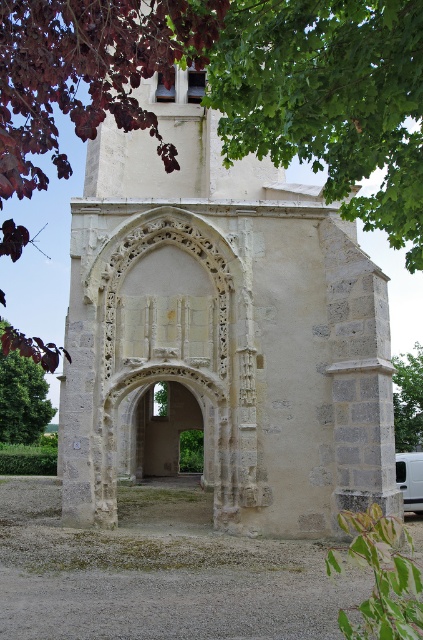
Question: Can you confirm if stone archway at center is positioned below green leafy tree at lower left?

Choices:
 (A) yes
 (B) no

Answer: (B)

Question: Estimate the real-world distances between objects in this image. Which object is farther from the green leafy tree at lower left?

Choices:
 (A) green leafy tree at right
 (B) white matte van at right
 (C) stone archway at center

Answer: (B)

Question: Estimate the real-world distances between objects in this image. Which object is closer to the stone archway at center?

Choices:
 (A) white matte van at right
 (B) green leafy tree at lower left

Answer: (A)

Question: Can you confirm if green leafy tree at lower left is wider than green leafy tree at right?

Choices:
 (A) no
 (B) yes

Answer: (B)

Question: Which of the following is the closest to the observer?

Choices:
 (A) white matte van at right
 (B) stone archway at center

Answer: (B)

Question: Can you confirm if stone archway at center is wider than white matte van at right?

Choices:
 (A) yes
 (B) no

Answer: (A)